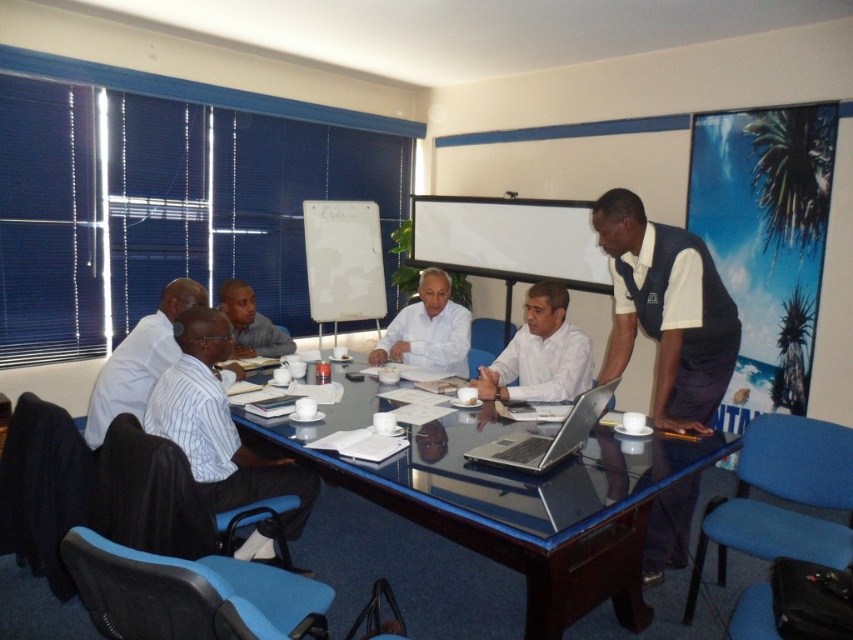
Which is more to the right, white shirt at center or white matte shirt at center?

Positioned to the right is white shirt at center.

Which is below, white shirt at center or white matte shirt at center?

white shirt at center

Which is behind, point (540, 324) or point (428, 278)?

The point (428, 278) is more distant.

At what (x,y) coordinates should I click in order to perform the action: click on white shirt at center. Please return your answer as a coordinate pair (x, y). Looking at the image, I should click on (540, 353).

Which is more to the left, dark blue uniform at right or white shirt at center?

From the viewer's perspective, white shirt at center appears more on the left side.

Measure the distance between point (660, 566) and camera.

Point (660, 566) and camera are 9.53 feet apart.

Who is more distant from viewer, (672,250) or (503,362)?

The point (503,362) is behind.

You are a GUI agent. You are given a task and a screenshot of the screen. Output one action in this format:
    pyautogui.click(x=<x>, y=<y>)
    Task: Click on the dark blue uniform at right
    This screenshot has width=853, height=640.
    Given the screenshot: What is the action you would take?
    pyautogui.click(x=666, y=310)

Is white striped shirt at lower left to the right of white shirt at center from the viewer's perspective?

Incorrect, white striped shirt at lower left is not on the right side of white shirt at center.

Between white striped shirt at lower left and white shirt at center, which one has less height?

white shirt at center

The width and height of the screenshot is (853, 640). I want to click on white striped shirt at lower left, so click(x=219, y=426).

Where is `white striped shirt at lower left`? white striped shirt at lower left is located at coordinates (219, 426).